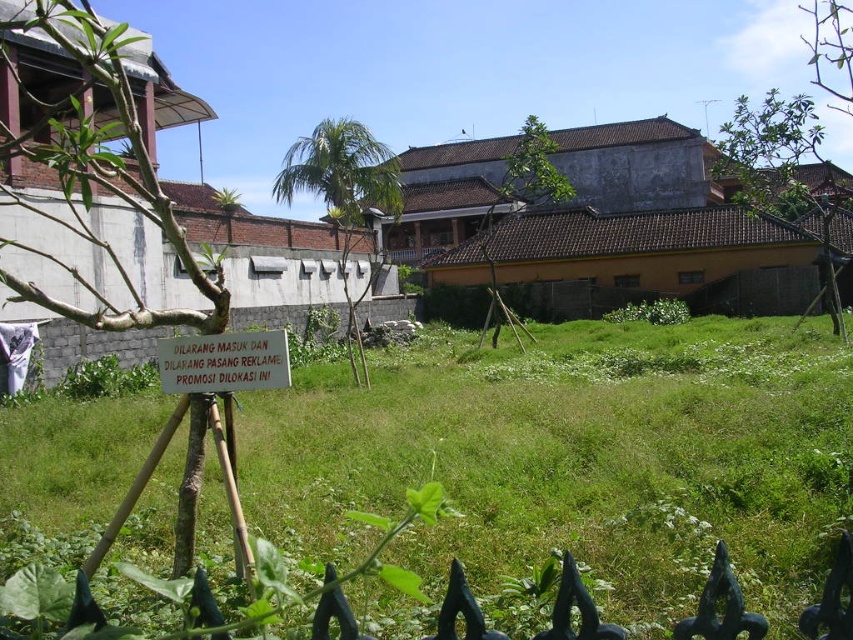
Between green grassy at center and white paper sign at center, which one is positioned lower?

Positioned lower is green grassy at center.

Which of these two, green grassy at center or white paper sign at center, stands shorter?

With less height is white paper sign at center.

This screenshot has width=853, height=640. Describe the element at coordinates (572, 474) in the screenshot. I see `green grassy at center` at that location.

The width and height of the screenshot is (853, 640). I want to click on green grassy at center, so click(572, 474).